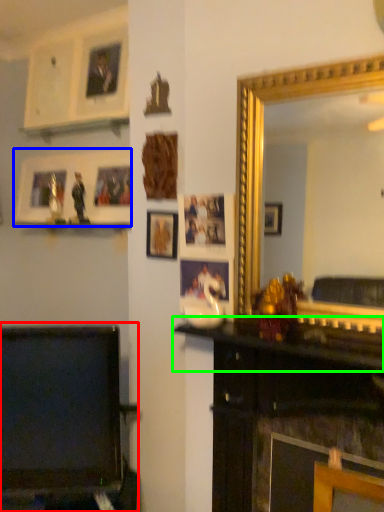
Question: Estimate the real-world distances between objects in this image. Which object is closer to furniture (highlighted by a red box), picture frame (highlighted by a blue box) or mantle (highlighted by a green box)?

Choices:
 (A) picture frame
 (B) mantle

Answer: (B)